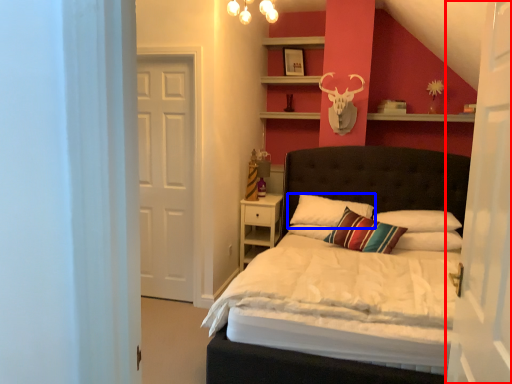
Question: Which object appears farthest to the camera in this image, door (highlighted by a red box) or pillow (highlighted by a blue box)?

Choices:
 (A) door
 (B) pillow

Answer: (B)